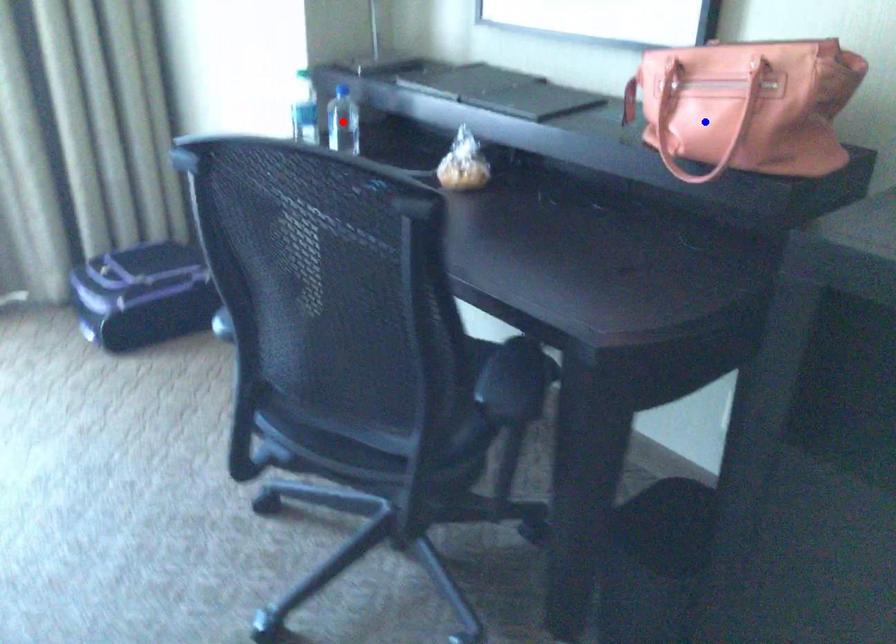
Question: Two points are marked on the image. Which point is closer to the camera?

Choices:
 (A) Blue point is closer.
 (B) Red point is closer.

Answer: (A)